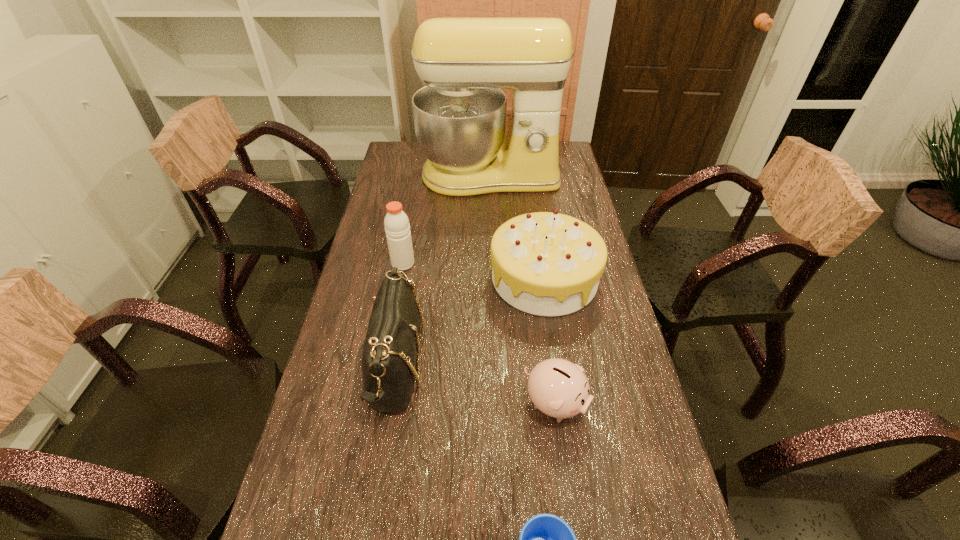
Find the location of a particular element. This screenshot has width=960, height=540. vacant area situated on the back of the second shortest object is located at coordinates (545, 329).

Identify the location of object that is at the far edge. This screenshot has width=960, height=540. (460, 115).

Image resolution: width=960 pixels, height=540 pixels. I want to click on mixer present at the left edge, so click(x=460, y=115).

I want to click on shaker situated at the left edge, so click(397, 228).

The height and width of the screenshot is (540, 960). I want to click on handbag present at the left edge, so click(390, 350).

You are a GUI agent. You are given a task and a screenshot of the screen. Output one action in this format:
    pyautogui.click(x=<x>, y=<y>)
    Task: Click on the mixer that is at the right edge
    The height and width of the screenshot is (540, 960).
    Given the screenshot: What is the action you would take?
    pyautogui.click(x=460, y=115)

At what (x,y) coordinates should I click in order to perform the action: click on birthday cake located in the right edge section of the desktop. Please return your answer as a coordinate pair (x, y). This screenshot has height=540, width=960. Looking at the image, I should click on 549,264.

Where is `piggy bank present at the right edge`? The height and width of the screenshot is (540, 960). piggy bank present at the right edge is located at coordinates (557, 387).

The width and height of the screenshot is (960, 540). Identify the location of object situated at the far left corner. (460, 115).

Image resolution: width=960 pixels, height=540 pixels. I want to click on object located at the far right corner, so click(460, 115).